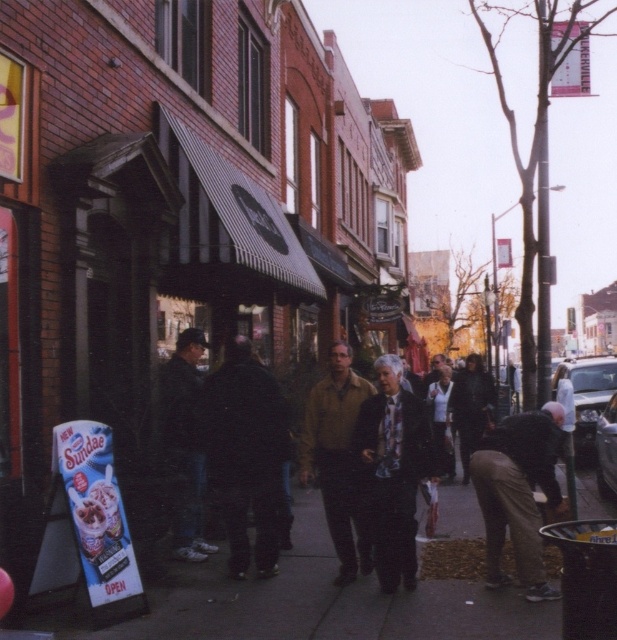
Does brown cotton pants at lower right appear on the right side of dark blue jeans at center?

Yes, brown cotton pants at lower right is to the right of dark blue jeans at center.

Is brown cotton pants at lower right smaller than dark blue jeans at center?

Actually, brown cotton pants at lower right might be larger than dark blue jeans at center.

What do you see at coordinates (518, 493) in the screenshot? I see `brown cotton pants at lower right` at bounding box center [518, 493].

Locate an element on the screen. The height and width of the screenshot is (640, 617). brown cotton pants at lower right is located at coordinates (518, 493).

Which of these two, brown cotton pants at lower right or white shirt at center, stands shorter?

With less height is white shirt at center.

Between point (524, 492) and point (444, 380), which one is positioned in front?

Positioned in front is point (524, 492).

Image resolution: width=617 pixels, height=640 pixels. I want to click on brown cotton pants at lower right, so click(518, 493).

The height and width of the screenshot is (640, 617). Describe the element at coordinates (317, 602) in the screenshot. I see `smooth concrete sidewalk at center` at that location.

Between point (337, 625) and point (331, 493), which one is positioned behind?

The point (331, 493) is behind.

The height and width of the screenshot is (640, 617). What are the coordinates of `smooth concrete sidewalk at center` in the screenshot? It's located at (317, 602).